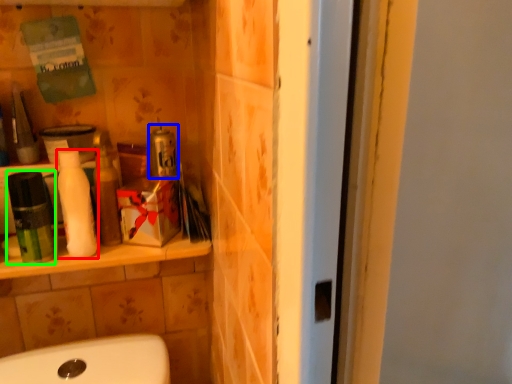
Question: Which object is positioned closest to cleaning product (highlighted by a red box)? Select from product (highlighted by a blue box) and mouthwash (highlighted by a green box).

Choices:
 (A) product
 (B) mouthwash

Answer: (B)